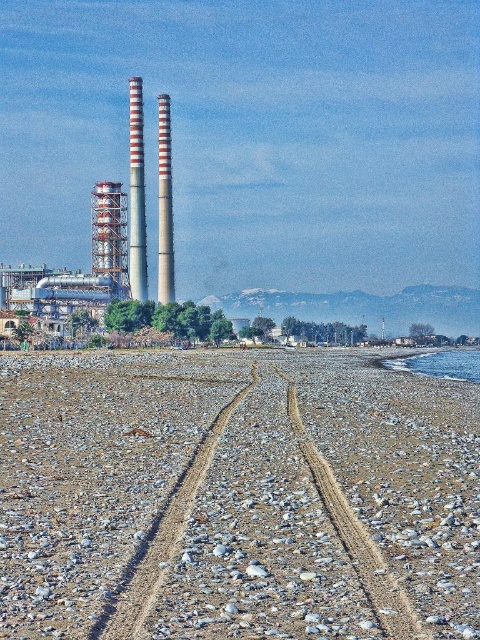
Question: Which point is farther to the camera?

Choices:
 (A) red and white striped chimney at center-left
 (B) red and white striped chimney at center

Answer: (B)

Question: Is smooth pebbles at center to the left of red and white striped chimney at center from the viewer's perspective?

Choices:
 (A) no
 (B) yes

Answer: (A)

Question: Among these points, which one is farthest from the camera?

Choices:
 (A) (383, 602)
 (B) (137, 161)
 (C) (445, 369)
 (D) (166, 285)

Answer: (D)

Question: Is smooth pebbles at center further to camera compared to clear blue water at lower right?

Choices:
 (A) no
 (B) yes

Answer: (A)

Question: Which object is positioned farthest from the clear blue water at lower right?

Choices:
 (A) red and white striped chimney at center-left
 (B) red and white striped chimney at center

Answer: (A)

Question: Does smooth pebbles at center have a larger size compared to red and white striped chimney at center?

Choices:
 (A) no
 (B) yes

Answer: (A)